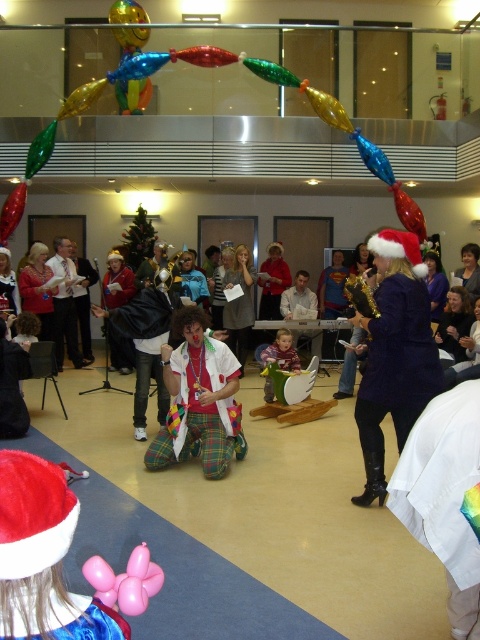
You are a guest at the holiday party and want to place a gift under the plaid fabric clown at center. Where should you place it relative to the red velvet santa hat at lower left?

The red velvet santa hat at lower left is above the plaid fabric clown at center, so you should place the gift below the red velvet santa hat at lower left to position it under the clown.

You are at the entrance of the venue and see the red velvet santa hat at lower left. Where exactly is it positioned in relation to the clown and the child?

The red velvet santa hat at lower left is located at point coordinates of 0.870 on the x axis and 0.090 on the y axis, so it is positioned at the lower left corner of the image, near the entrance where you are standing.